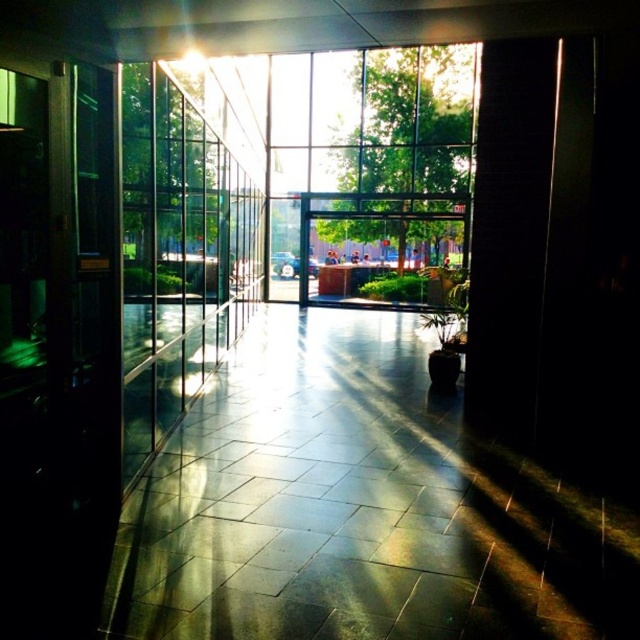
You are a delivery person holding a large box that is 1.5 meters wide. You need to carry it through the transparent glass door at left. Can you fit through the door without tilting the box sideways? Please consider the size of the shiny tile floor at center in your answer.

The shiny tile floor at center has a smaller size compared to the transparent glass door at left. Since the door is larger than the floor, the transparent glass door at left is wide enough to accommodate the 1.5 meter wide box without tilting it sideways.

You are standing in the lobby and want to move from the entrance to the exit. You see two points marked on the floor, point (x=280, y=65) and point (x=188, y=115). If you are facing the exit, which point is closer to you?

Point (x=188, y=115) is closer to you because it is in front of point (x=280, y=65) when facing the exit.